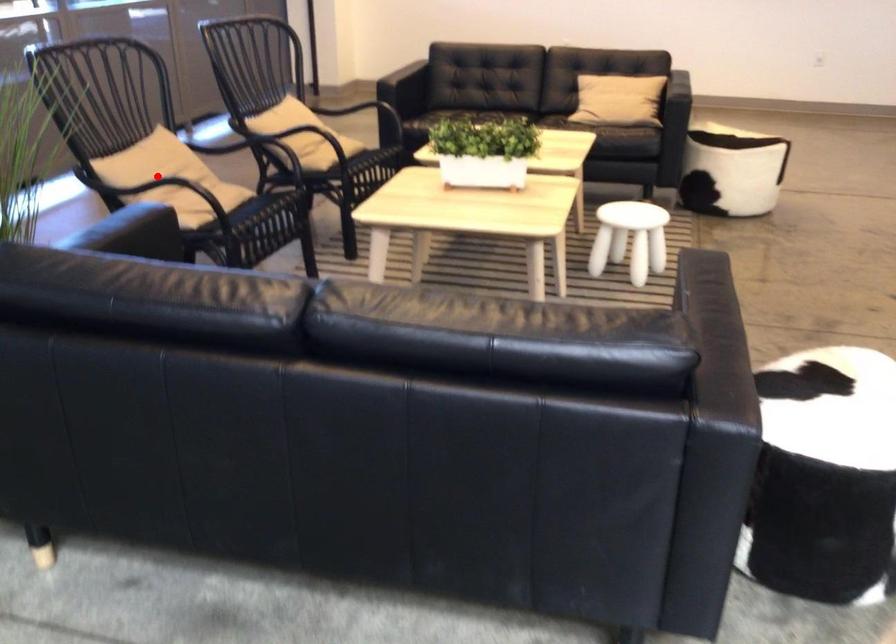
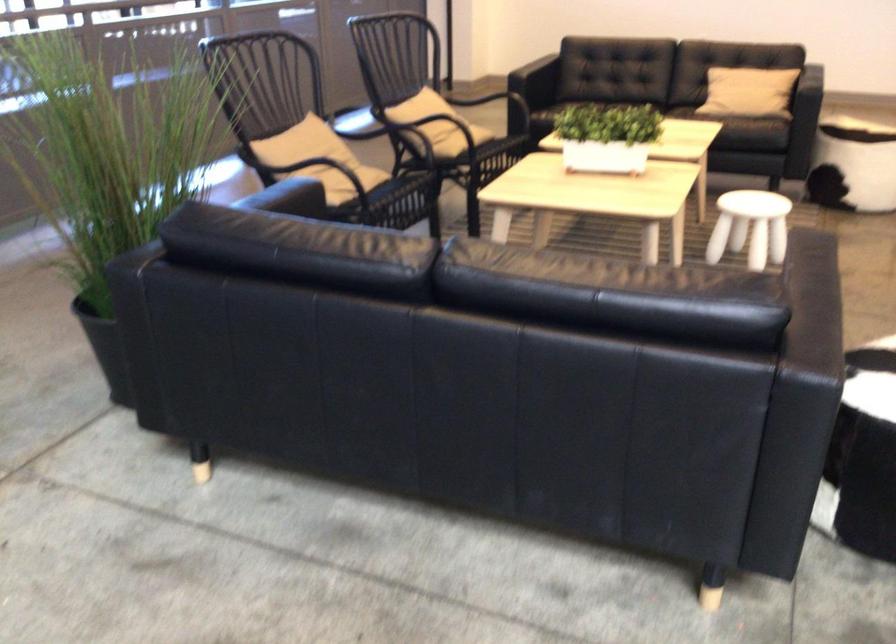
Where in the second image is the point corresponding to the highlighted location from the first image?

(308, 153)